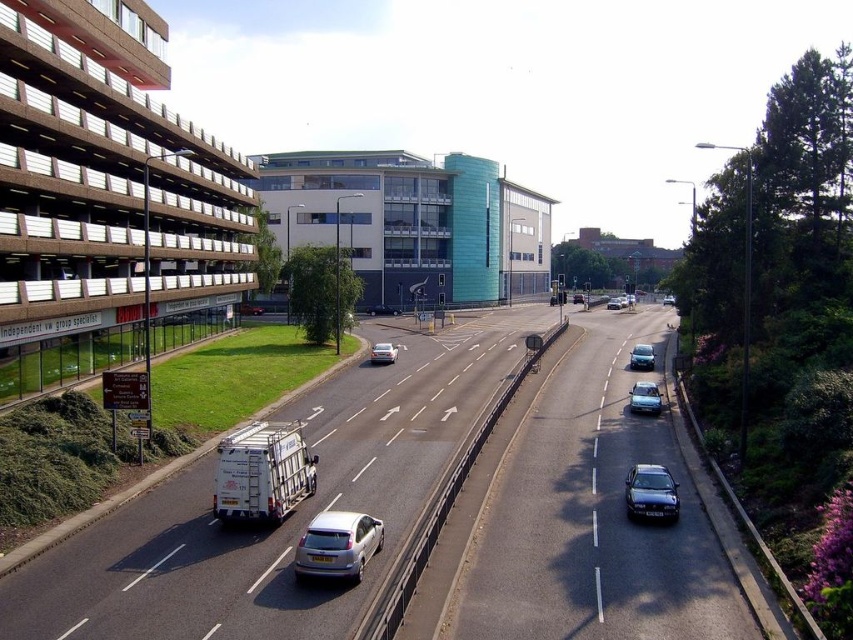
Is shiny black sedan at center thinner than metallic silver sedan at center-right?

Incorrect, shiny black sedan at center's width is not less than metallic silver sedan at center-right's.

Between shiny black sedan at center and metallic silver sedan at center-right, which one has more height?

With more height is shiny black sedan at center.

Image resolution: width=853 pixels, height=640 pixels. What do you see at coordinates (651, 492) in the screenshot? I see `shiny black sedan at center` at bounding box center [651, 492].

Find the location of a particular element. shiny black sedan at center is located at coordinates (651, 492).

Does metallic silver sedan at center-right have a larger size compared to satin silver sedan at center?

Actually, metallic silver sedan at center-right might be smaller than satin silver sedan at center.

The width and height of the screenshot is (853, 640). I want to click on metallic silver sedan at center-right, so click(x=645, y=397).

Which is below, white metallic truck at lower left or satin silver sedan at center?

white metallic truck at lower left

Is white metallic truck at lower left closer to camera compared to satin silver sedan at center?

Yes, white metallic truck at lower left is in front of satin silver sedan at center.

Is point (225, 490) more distant than point (393, 348)?

No, it is in front of (393, 348).

Identify the location of white metallic truck at lower left. The height and width of the screenshot is (640, 853). (262, 472).